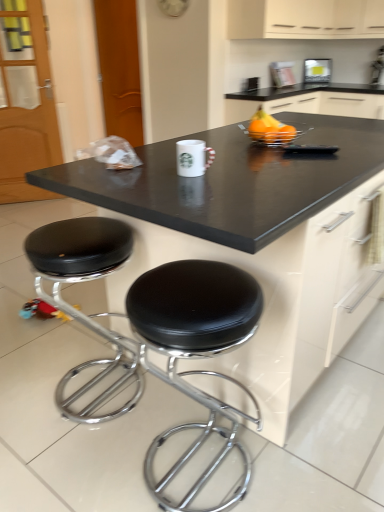
Locate an element on the screen. The image size is (384, 512). free space above black leather stool at lower center, which is the 2th stool in left-to-right order (from a real-world perspective) is located at coordinates (205, 294).